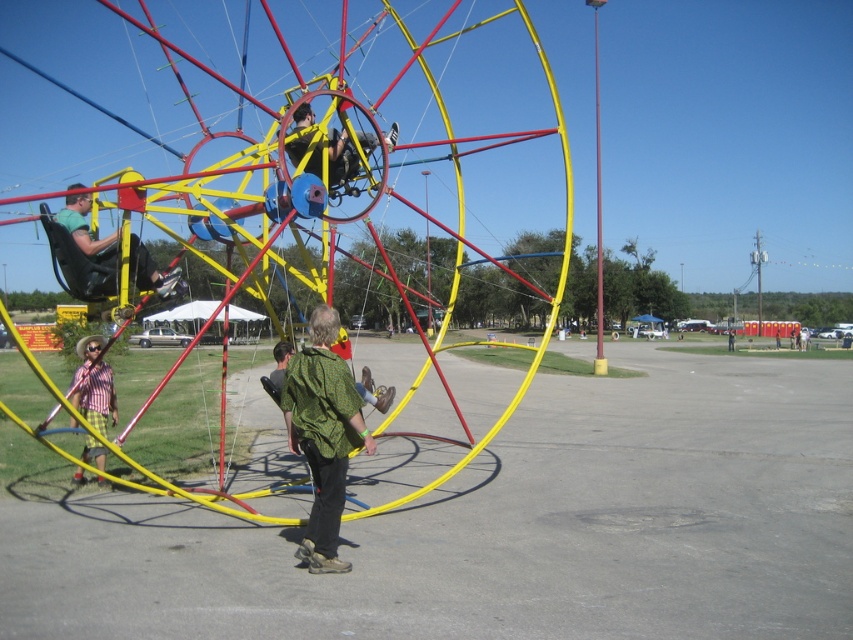
Which of these two, green textured shirt at center or matte black helmet at upper center, stands taller?

With more height is green textured shirt at center.

Can you confirm if green textured shirt at center is thinner than matte black helmet at upper center?

Correct, green textured shirt at center's width is less than matte black helmet at upper center's.

Is point (325, 401) less distant than point (292, 125)?

Yes, point (325, 401) is closer to viewer.

You are a GUI agent. You are given a task and a screenshot of the screen. Output one action in this format:
    pyautogui.click(x=<x>, y=<y>)
    Task: Click on the green textured shirt at center
    
    Given the screenshot: What is the action you would take?
    323,435

Between point (326, 397) and point (61, 212), which one is positioned in front?

Point (326, 397)

Which is behind, point (346, 435) or point (99, 241)?

The point (99, 241) is behind.

Does point (323, 536) come in front of point (83, 212)?

Yes.

What are the coordinates of `green textured shirt at center` in the screenshot? It's located at (323, 435).

Which is in front, point (316, 541) or point (85, 358)?

Point (316, 541)

Looking at this image, does green textured shirt at center have a lesser height compared to plaid shirt at left?

No, green textured shirt at center is not shorter than plaid shirt at left.

Which is behind, point (328, 358) or point (109, 378)?

Positioned behind is point (109, 378).

The image size is (853, 640). What are the coordinates of `green textured shirt at center` in the screenshot? It's located at (323, 435).